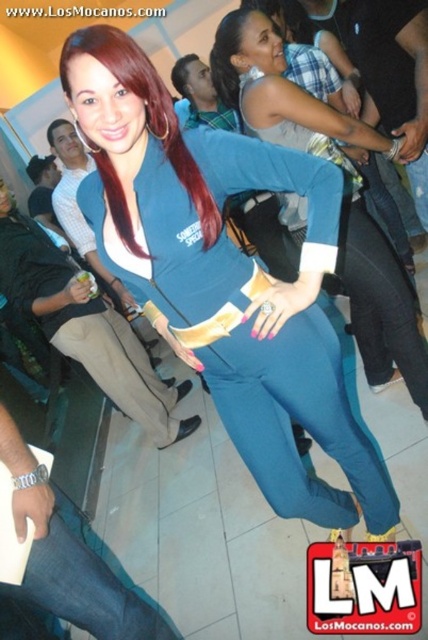
Is blue fabric pants at center wider than dark brown silky hair at upper left?

Indeed, blue fabric pants at center has a greater width compared to dark brown silky hair at upper left.

Which of these two, blue fabric pants at center or dark brown silky hair at upper left, stands shorter?

dark brown silky hair at upper left is shorter.

Is point (365, 218) positioned behind point (41, 164)?

No, it is not.

Locate an element on the screen. The height and width of the screenshot is (640, 428). blue fabric pants at center is located at coordinates (344, 196).

Who is positioned more to the right, dark brown hair at upper center or dark brown silky hair at upper left?

From the viewer's perspective, dark brown hair at upper center appears more on the right side.

The height and width of the screenshot is (640, 428). Describe the element at coordinates (183, 74) in the screenshot. I see `dark brown hair at upper center` at that location.

Which is behind, point (184, 70) or point (56, 164)?

Positioned behind is point (56, 164).

Where is `dark brown hair at upper center`? dark brown hair at upper center is located at coordinates (183, 74).

Is point (165, 179) closer to viewer compared to point (71, 124)?

Yes, point (165, 179) is closer to viewer.

Does matte blue jumpsuit at center have a smaller size compared to brown shiny hair at upper left?

No, matte blue jumpsuit at center is not smaller than brown shiny hair at upper left.

I want to click on matte blue jumpsuit at center, so click(225, 275).